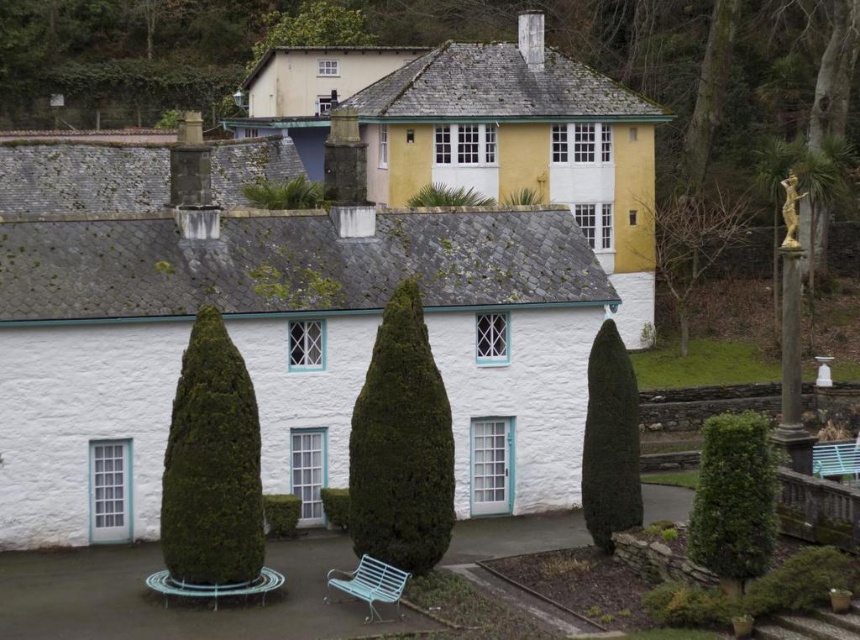
You are standing at the entrance of the house and want to sit on the white metal bench at lower center. Is the bare branches at right blocking your path?

The bare branches at right is further to the viewer than white metal bench at lower center, so the bench is closer to you. Therefore, the bare branches at right are not blocking your path to the bench.

You are a visitor arriving at the house and want to sit down to enjoy the garden. You see the green leafy hedge at right and the white metal bench at lower center. Which object is located to the right of the bench?

The green leafy hedge at right is positioned on the right side of the white metal bench at lower center.

In the scene shown: You are planning to place a new flower pot in the garden. The flower pot is the same size as the white metal bench at lower center. Based on the scene, will the flower pot be smaller than the bare branches at right?

The bare branches at right has a larger size compared to white metal bench at lower center, so the flower pot, being the same size as the white metal bench at lower center, will indeed be smaller than the bare branches at right.